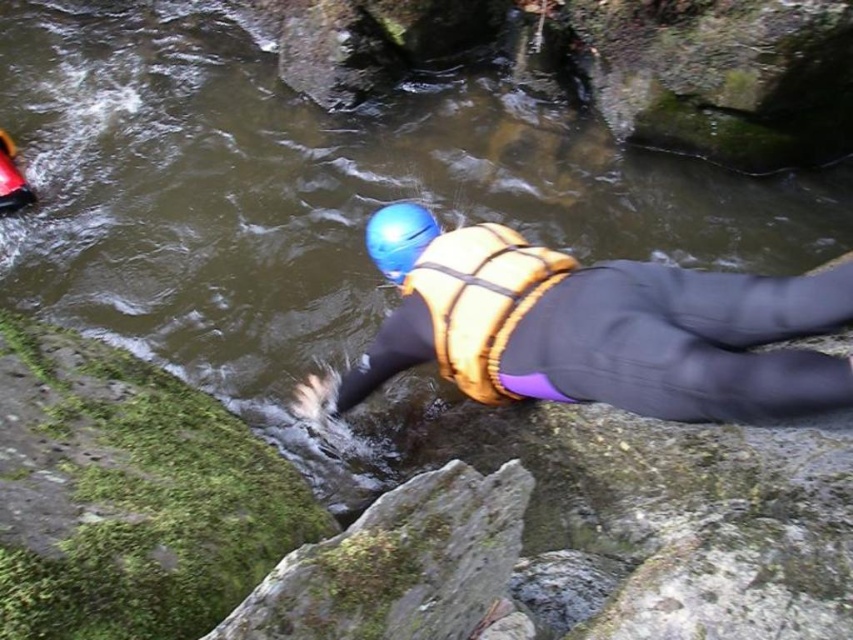
Question: Is matte yellow life vest at center above yellow textured safety vest at center?

Choices:
 (A) no
 (B) yes

Answer: (B)

Question: In this image, where is yellow textured safety vest at center located relative to blue matte helmet at center?

Choices:
 (A) above
 (B) below

Answer: (B)

Question: Which point is closer to the camera?

Choices:
 (A) yellow textured safety vest at center
 (B) matte yellow life vest at center
 (C) blue matte helmet at center

Answer: (B)

Question: Is matte yellow life vest at center below yellow textured safety vest at center?

Choices:
 (A) yes
 (B) no

Answer: (B)

Question: Among these points, which one is farthest from the camera?

Choices:
 (A) (813, 316)
 (B) (521, 298)
 (C) (403, 237)

Answer: (C)

Question: Among these objects, which one is nearest to the camera?

Choices:
 (A) matte yellow life vest at center
 (B) yellow textured safety vest at center
 (C) blue matte helmet at center

Answer: (A)